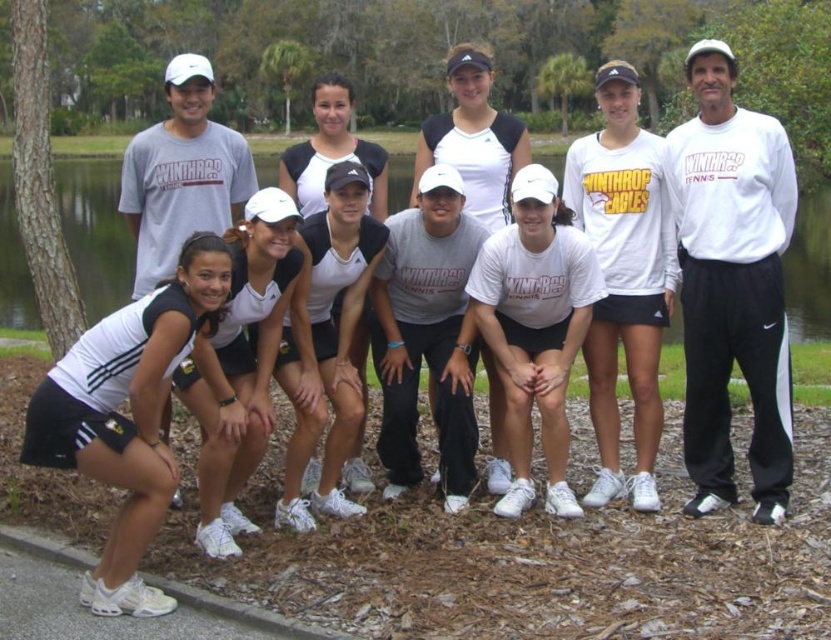
Is white matte sweatshirt at upper right below green water at lower left?

Correct, white matte sweatshirt at upper right is located below green water at lower left.

Identify the location of white matte sweatshirt at upper right. This screenshot has height=640, width=831. (731, 284).

Does green water at lower left appear under white cotton t-shirt at center?

No.

Who is higher up, green water at lower left or white cotton t-shirt at center?

green water at lower left is higher up.

Which is in front, point (271, 172) or point (200, 93)?

Point (200, 93)

At what (x,y) coordinates should I click in order to perform the action: click on green water at lower left. Please return your answer as a coordinate pair (x, y). The width and height of the screenshot is (831, 640). Looking at the image, I should click on (96, 230).

Is point (758, 413) positioned in front of point (166, 67)?

That is True.

Does white matte sweatshirt at upper right have a greater width compared to white cotton t-shirt at center?

No.

Does point (692, 348) come closer to viewer compared to point (225, 216)?

Yes, it is.

Where is `white matte sweatshirt at upper right`? Image resolution: width=831 pixels, height=640 pixels. white matte sweatshirt at upper right is located at coordinates (731, 284).